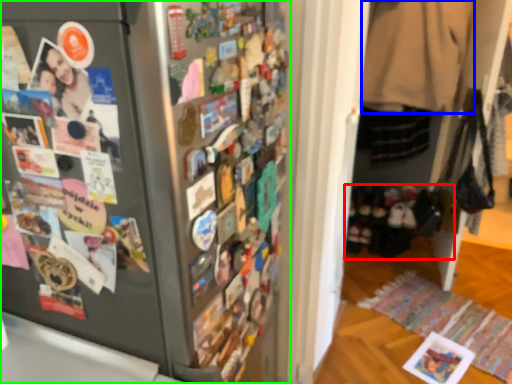
Question: Based on their relative distances, which object is nearer to footwear (highlighted by a red box)? Choose from clothing (highlighted by a blue box) and refrigerator (highlighted by a green box).

Choices:
 (A) clothing
 (B) refrigerator

Answer: (A)